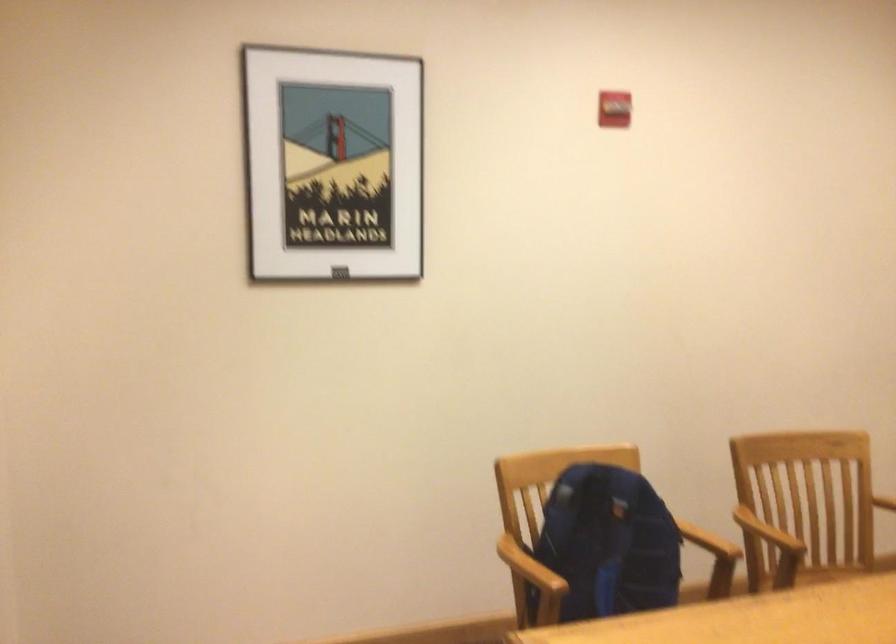
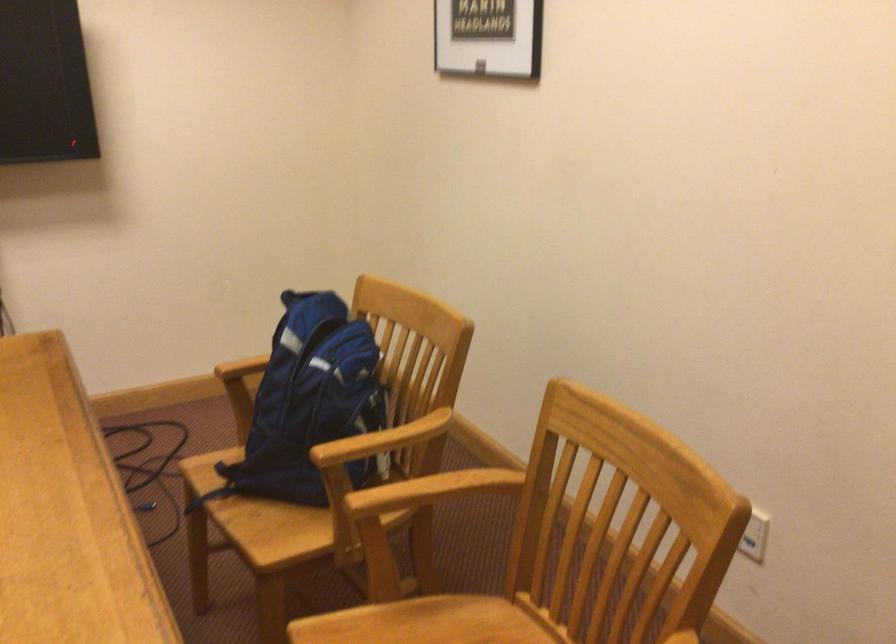
In the second image, find the point that corresponds to point 648,547 in the first image.

(309, 404)